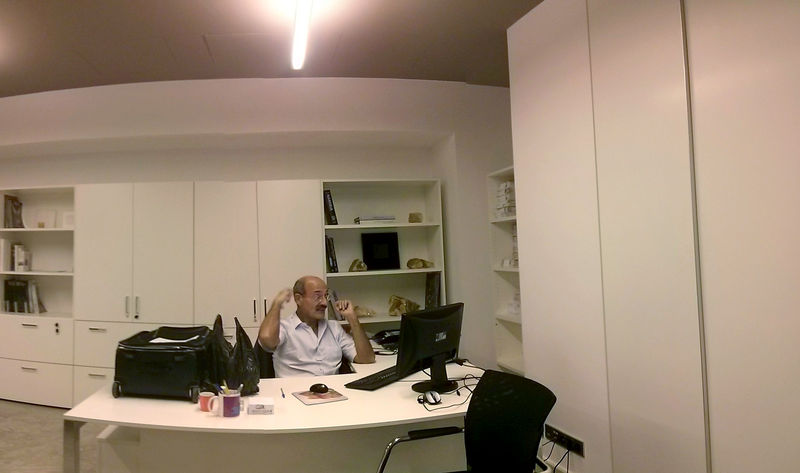
This screenshot has width=800, height=473. I want to click on mouse, so click(325, 387).